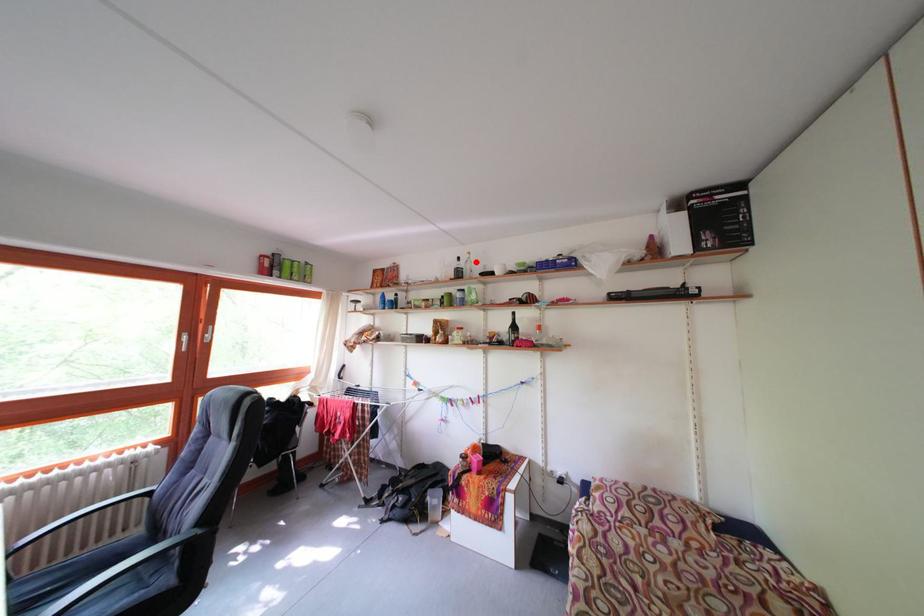
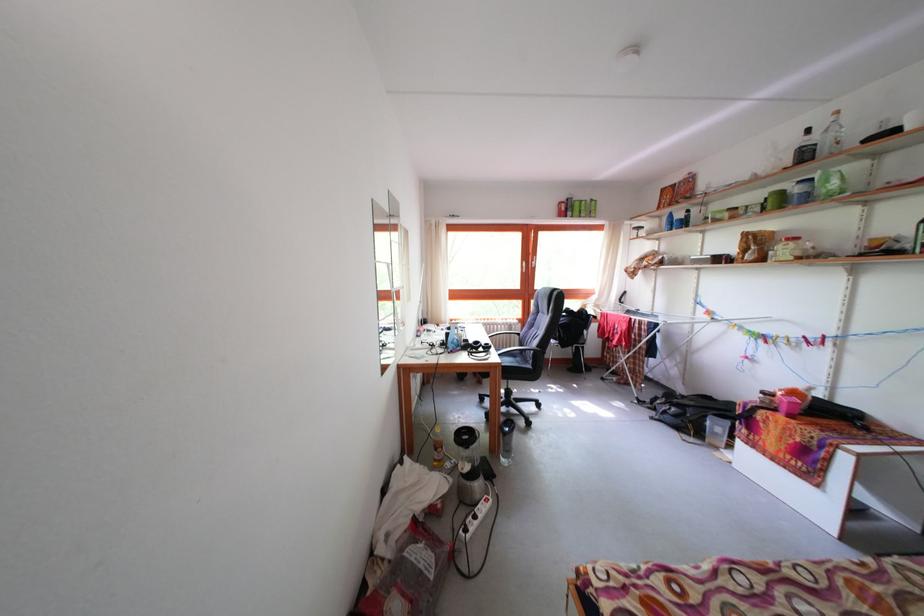
Where in the second image is the point corresponding to the highlighted location from the first image?

(843, 124)